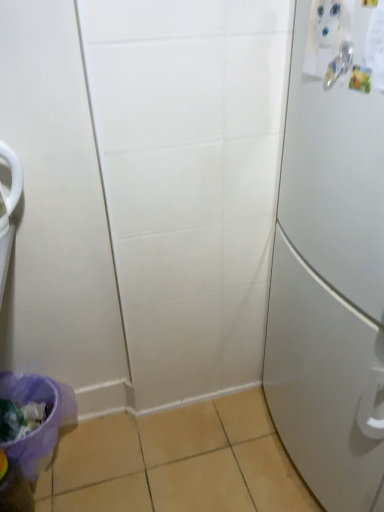
The width and height of the screenshot is (384, 512). What do you see at coordinates (339, 64) in the screenshot?
I see `silver metallic door handle at upper right` at bounding box center [339, 64].

Find the location of `white matte refrigerator at right`. white matte refrigerator at right is located at coordinates (331, 262).

Image resolution: width=384 pixels, height=512 pixels. I want to click on purple fabric potty at lower left, so click(x=39, y=426).

Would you say translucent plastic bottle at lower left is to the left or to the right of white matte refrigerator at right in the picture?

translucent plastic bottle at lower left is positioned on white matte refrigerator at right's left side.

Is translucent plastic bottle at lower left positioned behind white matte refrigerator at right?

Yes, translucent plastic bottle at lower left is further from the viewer.

Between translucent plastic bottle at lower left and white matte refrigerator at right, which one has larger width?

white matte refrigerator at right is wider.

Considering the points (25, 489) and (294, 212), which point is behind, point (25, 489) or point (294, 212)?

The point (25, 489) is behind.

Can you confirm if translucent plastic bottle at lower left is positioned to the right of silver metallic door handle at upper right?

No.

Does translucent plastic bottle at lower left have a smaller size compared to silver metallic door handle at upper right?

Incorrect, translucent plastic bottle at lower left is not smaller in size than silver metallic door handle at upper right.

Identify the location of bottle behind the silver metallic door handle at upper right. (14, 487).

From a real-world perspective, which object rests below the other?

In real-world perspective, translucent plastic bottle at lower left is lower.

Is purple fabric potty at lower left at the right side of white matte refrigerator at right?

No.

From a real-world perspective, between purple fabric potty at lower left and white matte refrigerator at right, who is vertically higher?

white matte refrigerator at right, from a real-world perspective.

Which of these two, purple fabric potty at lower left or white matte refrigerator at right, is thinner?

purple fabric potty at lower left.

From a real-world perspective, is white matte refrigerator at right physically located above or below translucent plastic bottle at lower left?

In terms of real-world spatial position, white matte refrigerator at right is above translucent plastic bottle at lower left.

This screenshot has height=512, width=384. In order to click on refrigerator that appears above the translucent plastic bottle at lower left (from the image's perspective) in this screenshot , I will do `click(331, 262)`.

Measure the distance between white matte refrigerator at right and translucent plastic bottle at lower left.

3.39 feet.

Considering the relative positions of white matte refrigerator at right and silver metallic door handle at upper right in the image provided, is white matte refrigerator at right to the left or to the right of silver metallic door handle at upper right?

white matte refrigerator at right is positioned on silver metallic door handle at upper right's right side.

Considering the relative sizes of white matte refrigerator at right and silver metallic door handle at upper right in the image provided, is white matte refrigerator at right shorter than silver metallic door handle at upper right?

Incorrect, the height of white matte refrigerator at right does not fall short of that of silver metallic door handle at upper right.

How many degrees apart are the facing directions of white matte refrigerator at right and silver metallic door handle at upper right?

They differ by 2.49 degrees in their facing directions.

Looking at their sizes, would you say white matte refrigerator at right is wider or thinner than silver metallic door handle at upper right?

In the image, white matte refrigerator at right appears to be wider than silver metallic door handle at upper right.

Can you tell me how much silver metallic door handle at upper right and purple fabric potty at lower left differ in facing direction?

176 degrees separate the facing orientations of silver metallic door handle at upper right and purple fabric potty at lower left.

Where is `potty behind the silver metallic door handle at upper right`? The image size is (384, 512). potty behind the silver metallic door handle at upper right is located at coordinates (39, 426).

Is silver metallic door handle at upper right aimed at purple fabric potty at lower left?

No, silver metallic door handle at upper right is not aimed at purple fabric potty at lower left.

Looking at this image, from the image's perspective, is silver metallic door handle at upper right positioned above or below purple fabric potty at lower left?

silver metallic door handle at upper right is above purple fabric potty at lower left.

Is point (331, 63) closer or farther from the camera than point (18, 503)?

Point (331, 63) is positioned closer to the camera compared to point (18, 503).

Does silver metallic door handle at upper right have a larger size compared to translucent plastic bottle at lower left?

No, silver metallic door handle at upper right is not bigger than translucent plastic bottle at lower left.

What's the angular difference between silver metallic door handle at upper right and translucent plastic bottle at lower left's facing directions?

They differ by 179 degrees in their facing directions.

At what (x,y) coordinates should I click in order to perform the action: click on bottle that is under the white matte refrigerator at right (from a real-world perspective). Please return your answer as a coordinate pair (x, y). The width and height of the screenshot is (384, 512). Looking at the image, I should click on (14, 487).

Where is `door handle above the translucent plastic bottle at lower left (from a real-world perspective)`? The width and height of the screenshot is (384, 512). door handle above the translucent plastic bottle at lower left (from a real-world perspective) is located at coordinates (339, 64).

Looking at this image, when comparing their distances from translucent plastic bottle at lower left, does purple fabric potty at lower left or silver metallic door handle at upper right seem further?

The object further to translucent plastic bottle at lower left is silver metallic door handle at upper right.

Looking at the image, which one is located further to white matte refrigerator at right, silver metallic door handle at upper right or translucent plastic bottle at lower left?

translucent plastic bottle at lower left is further to white matte refrigerator at right.

Considering their positions, is silver metallic door handle at upper right positioned closer to purple fabric potty at lower left than white matte refrigerator at right?

white matte refrigerator at right is closer to purple fabric potty at lower left.

Consider the image. Looking at the image, which one is located further to silver metallic door handle at upper right, purple fabric potty at lower left or white matte refrigerator at right?

purple fabric potty at lower left lies further to silver metallic door handle at upper right than the other object.

Considering their positions, is white matte refrigerator at right positioned closer to silver metallic door handle at upper right than translucent plastic bottle at lower left?

Among the two, white matte refrigerator at right is located nearer to silver metallic door handle at upper right.

Estimate the real-world distances between objects in this image. Which object is further from translucent plastic bottle at lower left, white matte refrigerator at right or silver metallic door handle at upper right?

Among the two, silver metallic door handle at upper right is located further to translucent plastic bottle at lower left.

Considering their positions, is white matte refrigerator at right positioned further to purple fabric potty at lower left than translucent plastic bottle at lower left?

white matte refrigerator at right lies further to purple fabric potty at lower left than the other object.

Estimate the real-world distances between objects in this image. Which object is closer to translucent plastic bottle at lower left, white matte refrigerator at right or purple fabric potty at lower left?

The object closer to translucent plastic bottle at lower left is purple fabric potty at lower left.

Identify the location of potty between translucent plastic bottle at lower left and white matte refrigerator at right in the horizontal direction. The height and width of the screenshot is (512, 384). (39, 426).

Where is `potty between silver metallic door handle at upper right and translucent plastic bottle at lower left in the up-down direction`? The image size is (384, 512). potty between silver metallic door handle at upper right and translucent plastic bottle at lower left in the up-down direction is located at coordinates (39, 426).

Locate an element on the screen. The image size is (384, 512). door handle located between purple fabric potty at lower left and white matte refrigerator at right in the left-right direction is located at coordinates (339, 64).

This screenshot has height=512, width=384. Identify the location of door handle located between translucent plastic bottle at lower left and white matte refrigerator at right in the left-right direction. (339, 64).